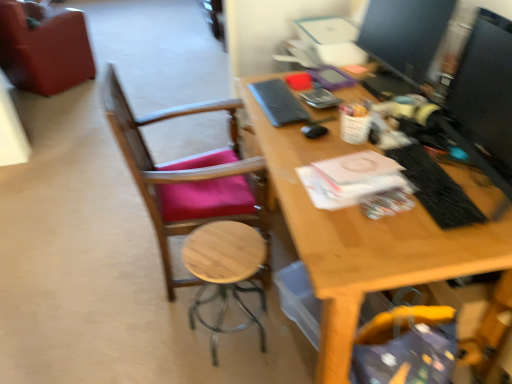
Question: Is matte black monitor at upper right surrounded by black textured laptop keyboard at right?

Choices:
 (A) yes
 (B) no

Answer: (B)

Question: Is black textured laptop keyboard at right in front of matte black monitor at upper right?

Choices:
 (A) no
 (B) yes

Answer: (B)

Question: From the image's perspective, is black textured laptop keyboard at right beneath matte black monitor at upper right?

Choices:
 (A) yes
 (B) no

Answer: (A)

Question: Is black textured laptop keyboard at right shorter than matte black monitor at upper right?

Choices:
 (A) no
 (B) yes

Answer: (B)

Question: Can you confirm if black textured laptop keyboard at right is positioned to the left of matte black monitor at upper right?

Choices:
 (A) no
 (B) yes

Answer: (B)

Question: Based on their positions, is black textured laptop keyboard at right located to the left or right of matte black monitor at upper right?

Choices:
 (A) right
 (B) left

Answer: (B)

Question: From a real-world perspective, is black textured laptop keyboard at right positioned above or below matte black monitor at upper right?

Choices:
 (A) above
 (B) below

Answer: (B)

Question: Considering the positions of black textured laptop keyboard at right and matte black monitor at upper right in the image, is black textured laptop keyboard at right wider or thinner than matte black monitor at upper right?

Choices:
 (A) thin
 (B) wide

Answer: (A)

Question: Is black textured laptop keyboard at right spatially inside matte black monitor at upper right, or outside of it?

Choices:
 (A) outside
 (B) inside

Answer: (A)

Question: In the image, is black textured laptop keyboard at right positioned in front of or behind velvet-like red chair at upper left, arranged as the first chair when viewed from the back?

Choices:
 (A) front
 (B) behind

Answer: (A)

Question: In the image, is black textured laptop keyboard at right on the left side or the right side of velvet-like red chair at upper left, the second chair in the front-to-back sequence?

Choices:
 (A) left
 (B) right

Answer: (B)

Question: In terms of size, does black textured laptop keyboard at right appear bigger or smaller than velvet-like red chair at upper left, which is counted as the 2th chair, starting from the right?

Choices:
 (A) small
 (B) big

Answer: (A)

Question: From a real-world perspective, is black textured laptop keyboard at right positioned above or below velvet-like red chair at upper left, the second chair in the front-to-back sequence?

Choices:
 (A) below
 (B) above

Answer: (B)

Question: From their relative heights in the image, would you say wooden stool at center is taller or shorter than velvet-like red chair at upper left, acting as the 1th chair starting from the top?

Choices:
 (A) short
 (B) tall

Answer: (A)

Question: Considering the relative positions of wooden stool at center and velvet-like red chair at upper left, arranged as the first chair when viewed from the back, in the image provided, is wooden stool at center to the left or to the right of velvet-like red chair at upper left, arranged as the first chair when viewed from the back,?

Choices:
 (A) right
 (B) left

Answer: (A)